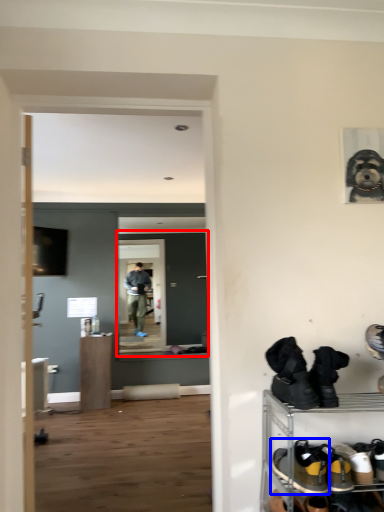
Question: Which of the following is the closest to the observer, glass door (highlighted by a red box) or footwear (highlighted by a blue box)?

Choices:
 (A) glass door
 (B) footwear

Answer: (B)